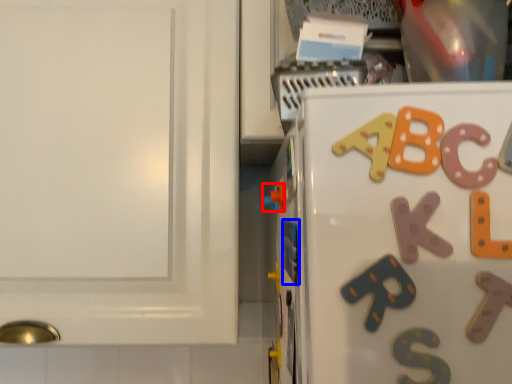
Question: Among these objects, which one is nearest to the camera, toy (highlighted by a red box) or magnet (highlighted by a blue box)?

Choices:
 (A) toy
 (B) magnet

Answer: (B)